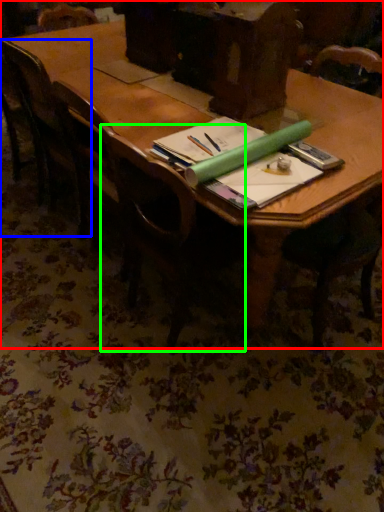
Question: Estimate the real-world distances between objects in this image. Which object is farther from table (highlighted by a red box), chair (highlighted by a blue box) or chair (highlighted by a green box)?

Choices:
 (A) chair
 (B) chair

Answer: (B)